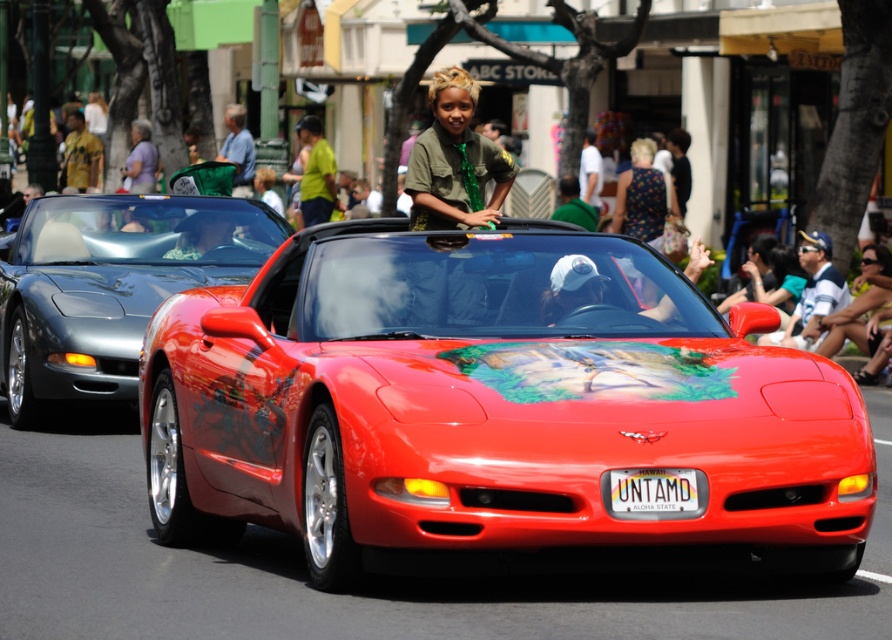
Can you confirm if shiny metallic car at left is thinner than green fabric shirt at center?

No, shiny metallic car at left is not thinner than green fabric shirt at center.

Can you confirm if shiny metallic car at left is positioned above green fabric shirt at center?

No, shiny metallic car at left is not above green fabric shirt at center.

This screenshot has height=640, width=892. I want to click on shiny metallic car at left, so click(x=109, y=285).

Where is `shiny metallic car at left`? shiny metallic car at left is located at coordinates (109, 285).

Which is below, white plastic license plate at center or green fabric shirt at center?

Positioned lower is white plastic license plate at center.

Who is higher up, white plastic license plate at center or green fabric shirt at center?

Positioned higher is green fabric shirt at center.

Find the location of a particular element. white plastic license plate at center is located at coordinates (653, 492).

Between point (23, 360) and point (642, 493), which one is positioned behind?

The point (23, 360) is behind.

What do you see at coordinates (109, 285) in the screenshot? I see `shiny metallic car at left` at bounding box center [109, 285].

Who is more forward, (44,202) or (669,468)?

Point (669,468)

The height and width of the screenshot is (640, 892). Identify the location of shiny metallic car at left. (109, 285).